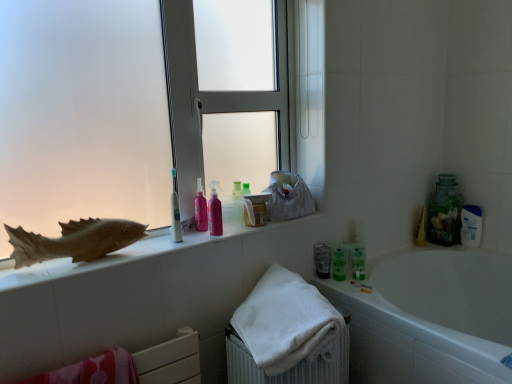
Where is `vacant space situated on the left part of pink glossy mouthwash at center, which is the 1th mouthwash from left to right`? This screenshot has height=384, width=512. vacant space situated on the left part of pink glossy mouthwash at center, which is the 1th mouthwash from left to right is located at coordinates (180, 230).